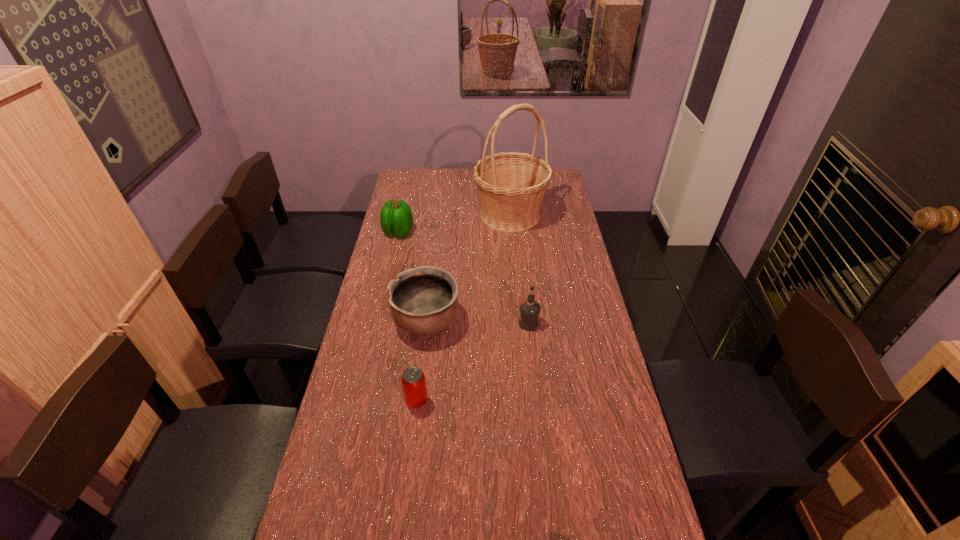
Identify the location of empty space that is in between the vodka and the bell pepper. (464, 278).

The image size is (960, 540). What are the coordinates of `unoccupied area between the nearest object and the pottery` in the screenshot? It's located at [421, 361].

Locate an element on the screen. free space that is in between the vodka and the pottery is located at coordinates (477, 322).

Locate which object is the closest to the vodka. Please provide its 2D coordinates. Your answer should be formatted as a tuple, i.e. [(x, y)], where the tuple contains the x and y coordinates of a point satisfying the conditions above.

[(423, 300)]

Identify the location of object that is the third closest to the pottery. This screenshot has width=960, height=540. (396, 219).

Identify the location of vacant space that satisfies the following two spatial constraints: 1. on the back side of the nearest object; 2. on the left side of the tallest object. Image resolution: width=960 pixels, height=540 pixels. (440, 214).